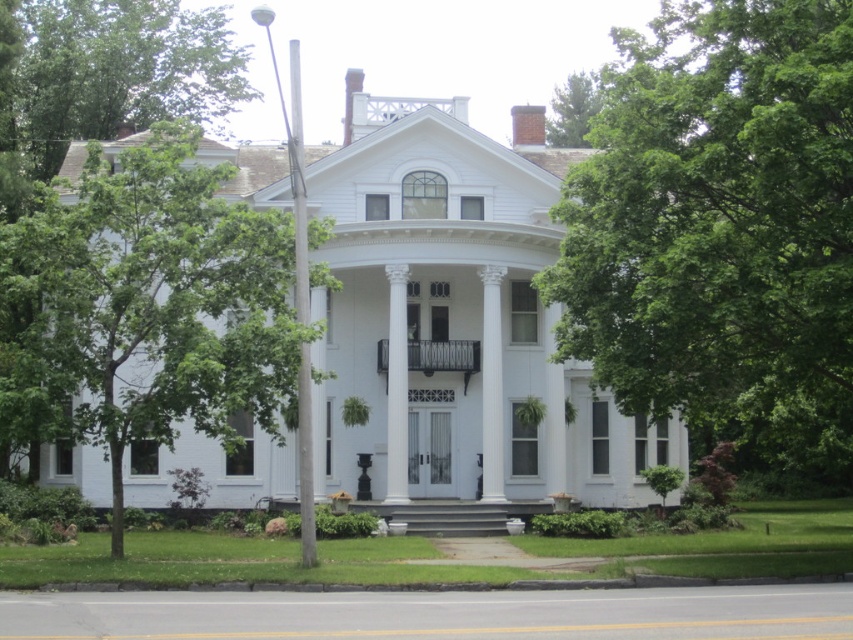
Is green leafy tree at upper left to the right of white glossy column at center from the viewer's perspective?

No, green leafy tree at upper left is not to the right of white glossy column at center.

Between green leafy tree at upper left and white glossy column at center, which one has less height?

white glossy column at center is shorter.

Who is more forward, (10,202) or (397,394)?

Positioned in front is point (397,394).

Identify the location of green leafy tree at upper left. The image size is (853, 640). (103, 76).

Is point (695, 58) closer to camera compared to point (401, 282)?

That is True.

Is green leafy tree at center further to camera compared to white glossy column at center?

No.

At what (x,y) coordinates should I click in order to perform the action: click on green leafy tree at center. Please return your answer as a coordinate pair (x, y). The image size is (853, 640). Looking at the image, I should click on (720, 228).

Is smooth gray pole at center to the left of white glossy column at center from the viewer's perspective?

Correct, you'll find smooth gray pole at center to the left of white glossy column at center.

Between smooth gray pole at center and white glossy column at center, which one is positioned higher?

smooth gray pole at center

Locate an element on the screen. The height and width of the screenshot is (640, 853). smooth gray pole at center is located at coordinates (299, 188).